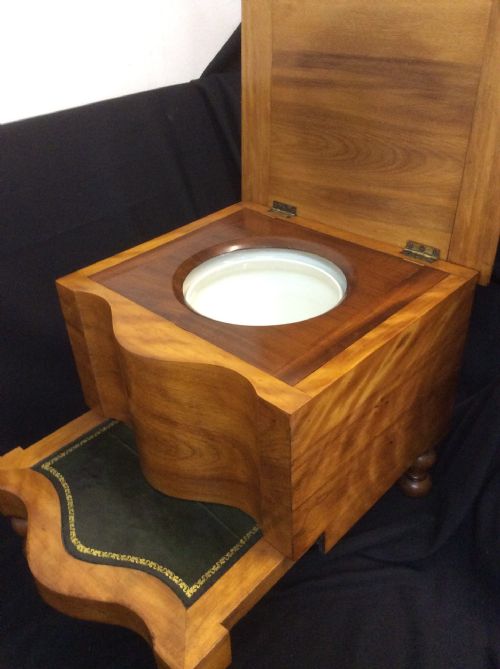
Identify the location of furniture leg. (419, 484), (18, 524).